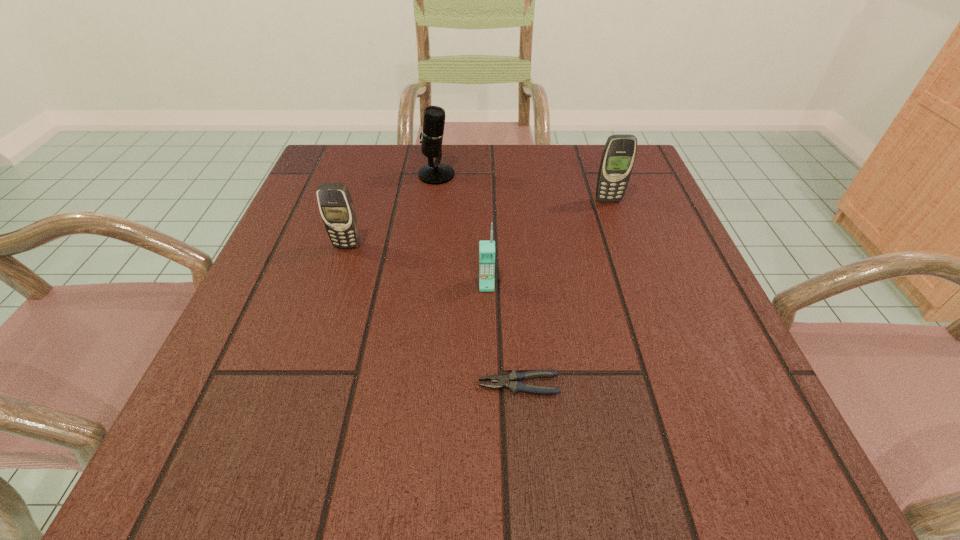
You are a GUI agent. You are given a task and a screenshot of the screen. Output one action in this format:
    pyautogui.click(x=<x>, y=<y>)
    Task: Click on the object positioned at the right edge
    
    Given the screenshot: What is the action you would take?
    pyautogui.click(x=619, y=153)

Find the location of a particular element. object positioned at the far right corner is located at coordinates (619, 153).

Locate an element on the screen. The height and width of the screenshot is (540, 960). free space at the far edge is located at coordinates (395, 188).

Find the location of `vacant region at the near edge of the desktop`. vacant region at the near edge of the desktop is located at coordinates (418, 450).

Where is `vacant region at the left edge`? vacant region at the left edge is located at coordinates (281, 367).

Locate an element on the screen. The image size is (960, 540). free point at the right edge is located at coordinates (609, 234).

Identify the location of vacant space at the far left corner of the desktop. This screenshot has width=960, height=540. (330, 166).

Locate an element on the screen. This screenshot has width=960, height=540. free spot at the far right corner of the desktop is located at coordinates (633, 171).

In the image, there is a desktop. Identify the location of vacant region at the near right corner. The height and width of the screenshot is (540, 960). (708, 442).

Find the location of `vacant area between the nearest object and the rightmost object`. vacant area between the nearest object and the rightmost object is located at coordinates (564, 293).